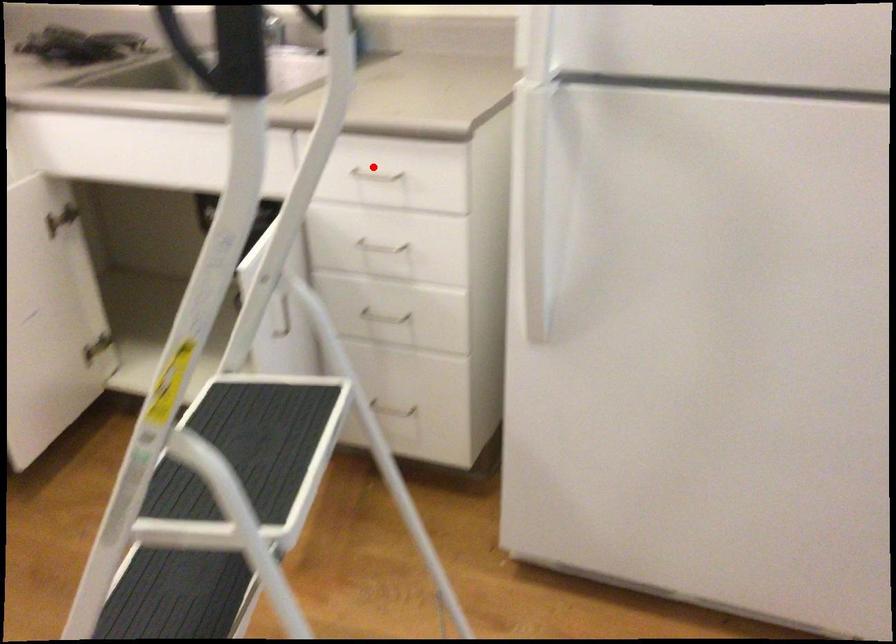
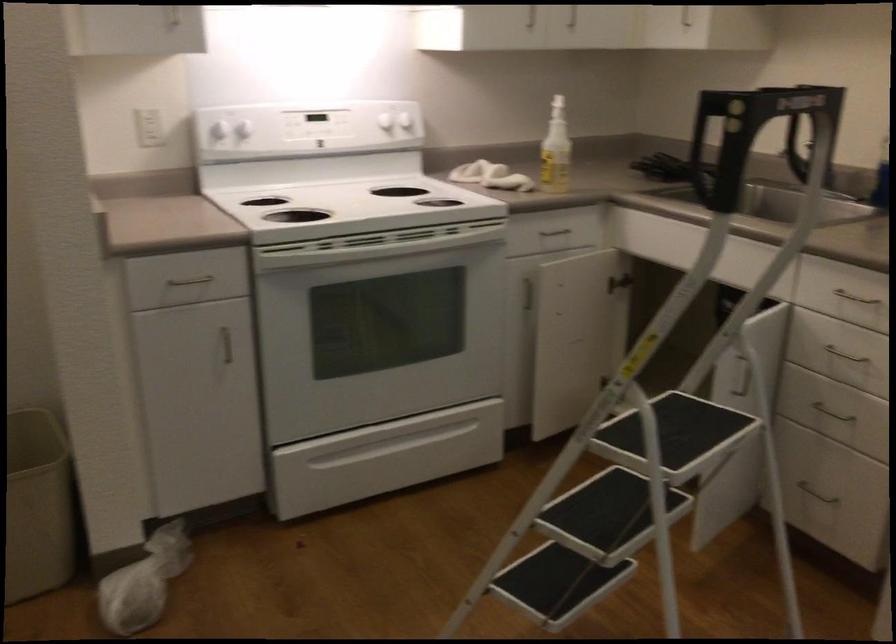
Where in the second image is the point corresponding to the highlighted location from the first image?

(863, 289)